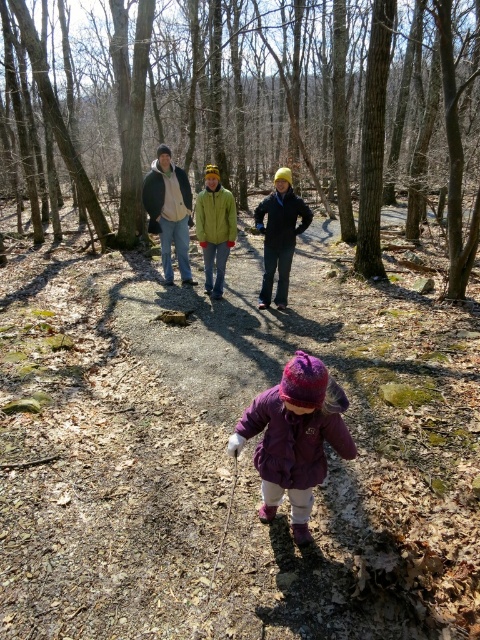
Looking at this image, does smooth bark trees at upper center have a lesser height compared to purple fleece jacket at center?

In fact, smooth bark trees at upper center may be taller than purple fleece jacket at center.

Does point (288, 45) lie in front of point (268, 460)?

That is False.

The height and width of the screenshot is (640, 480). In order to click on smooth bark trees at upper center in this screenshot , I will do `click(264, 113)`.

Which is more to the left, smooth bark trees at upper center or matte yellow jacket at center?

smooth bark trees at upper center

Does point (336, 77) come in front of point (261, 220)?

That is False.

Who is more forward, [22,157] or [266,305]?

Point [266,305]

The image size is (480, 640). What are the coordinates of `smooth bark trees at upper center` in the screenshot? It's located at (264, 113).

Is point (288, 362) more distant than point (280, 193)?

No, it is not.

The height and width of the screenshot is (640, 480). In order to click on purple fleece jacket at center in this screenshot , I will do `click(295, 436)`.